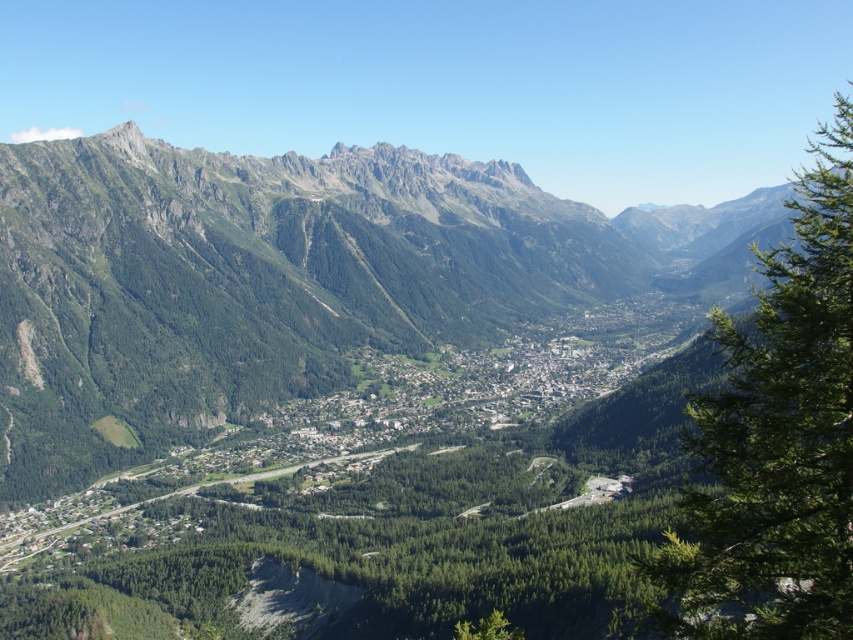
Which is in front, point (273, 360) or point (733, 358)?

Point (733, 358) is more forward.

Does green textured mountain range at center appear on the left side of green leafy tree at right?

Correct, you'll find green textured mountain range at center to the left of green leafy tree at right.

The height and width of the screenshot is (640, 853). What do you see at coordinates (286, 280) in the screenshot?
I see `green textured mountain range at center` at bounding box center [286, 280].

What are the coordinates of `green textured mountain range at center` in the screenshot? It's located at (286, 280).